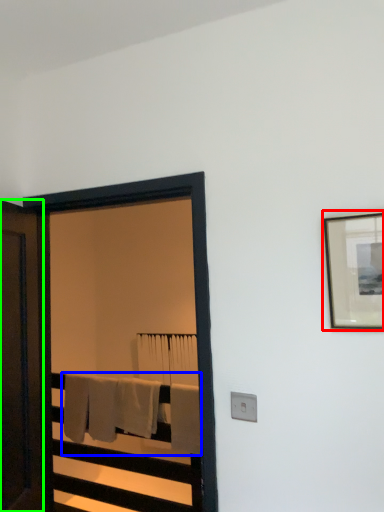
Question: Estimate the real-world distances between objects in this image. Which object is closer to picture frame (highlighted by a red box), bath towel (highlighted by a blue box) or door (highlighted by a green box)?

Choices:
 (A) bath towel
 (B) door

Answer: (B)